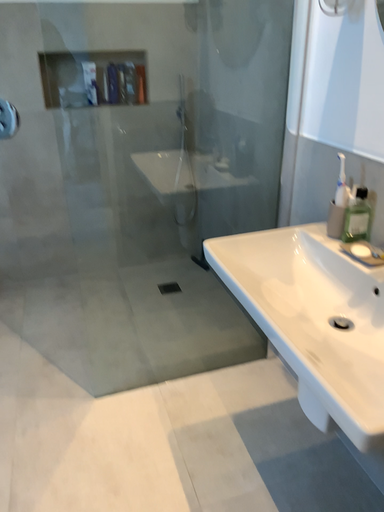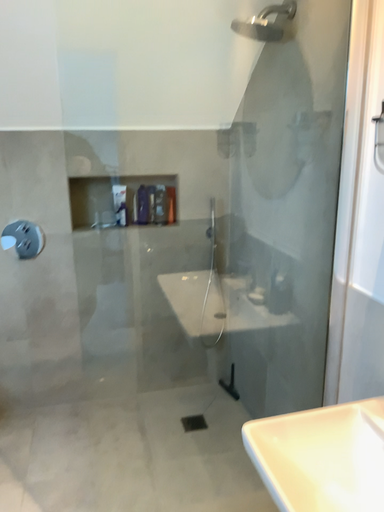
Question: How did the camera likely rotate when shooting the video?

Choices:
 (A) rotated upward
 (B) rotated downward

Answer: (A)